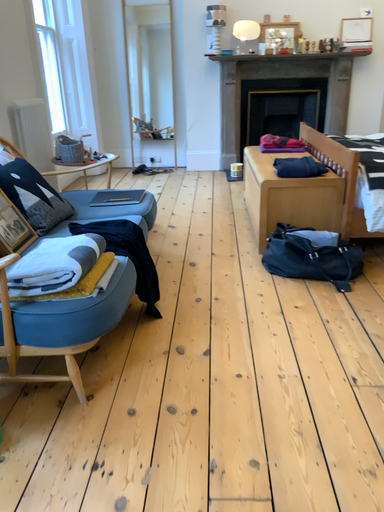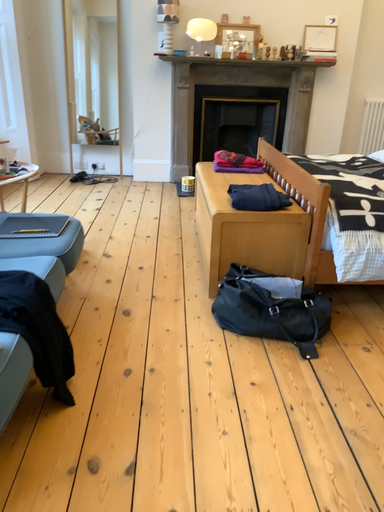
Question: Which way did the camera rotate in the video?

Choices:
 (A) rotated right
 (B) rotated left

Answer: (A)